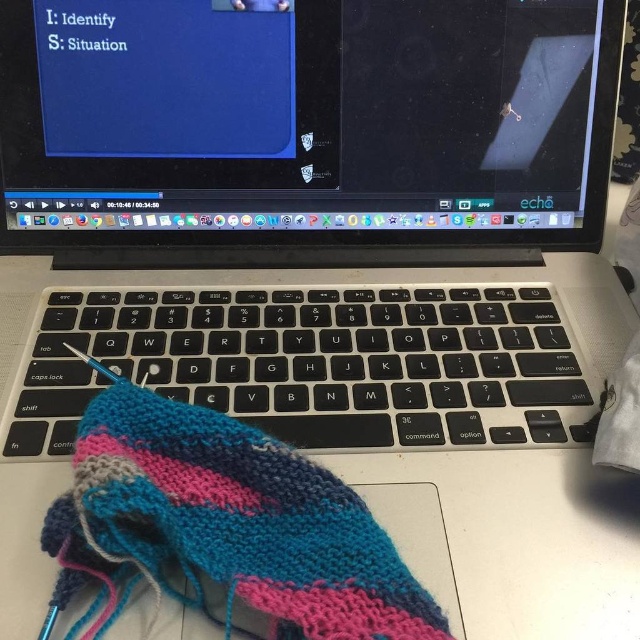
Question: Considering the relative positions of satin black laptop at center and black matte keyboard at center in the image provided, where is satin black laptop at center located with respect to black matte keyboard at center?

Choices:
 (A) right
 (B) left

Answer: (A)

Question: Which point appears farthest from the camera in this image?

Choices:
 (A) (180, 74)
 (B) (515, 342)
 (C) (193, 490)

Answer: (A)

Question: Does satin black laptop at center lie in front of knitted woolen sock at lower left?

Choices:
 (A) no
 (B) yes

Answer: (A)

Question: Which object is positioned farthest from the knitted woolen sock at lower left?

Choices:
 (A) satin black laptop at center
 (B) black matte keyboard at center

Answer: (A)

Question: Considering the relative positions of black matte keyboard at center and knitted woolen sock at lower left in the image provided, where is black matte keyboard at center located with respect to knitted woolen sock at lower left?

Choices:
 (A) left
 (B) right

Answer: (B)

Question: Based on their relative distances, which object is nearer to the knitted woolen sock at lower left?

Choices:
 (A) black matte keyboard at center
 (B) satin black laptop at center

Answer: (A)